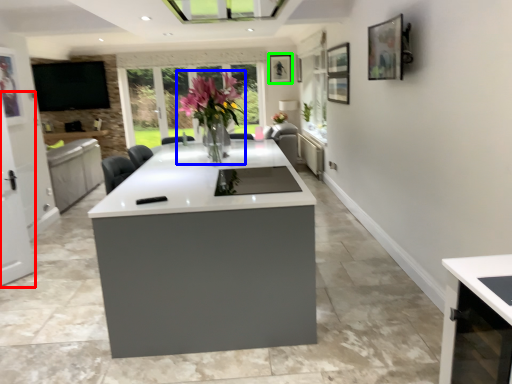
Question: Considering the real-world distances, which object is closest to screen door (highlighted by a red box)? floral arrangement (highlighted by a blue box) or picture frame (highlighted by a green box).

Choices:
 (A) floral arrangement
 (B) picture frame

Answer: (A)